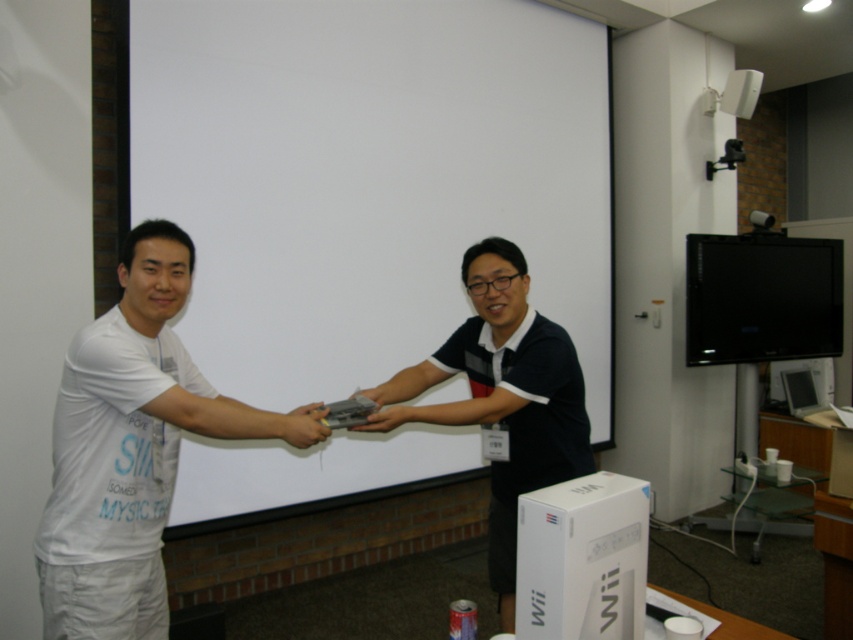
You are an interior designer planning to install a new lighting system in the room. The white matte projection screen at center and the dark blue polo shirt at center are both in the center. Which object will require a brighter light to be clearly visible?

The white matte projection screen at center requires a brighter light to be clearly visible because it has a larger size compared to the dark blue polo shirt at center, meaning it needs more illumination to maintain visibility.

You are an assistant who needs to set up a presentation. The white matte projection screen at center and the matte gray controller at center are both in the room. Where should you place the projector to ensure the presentation is visible on the screen?

The white matte projection screen at center is above the matte gray controller at center, so you should place the projector in front of the screen at a distance that allows the projected image to cover the screen properly, ensuring it is positioned above the controller.

You are standing in the room and want to project a movie onto the white matte projection screen at center. If your projector requires a minimum distance of 2.5 meters to function properly, will it work in this setup?

The distance between the white matte projection screen at center and the viewer is 2.80 meters, which is greater than the projector requirement of 2.5 meters. Therefore, the projector will work properly.